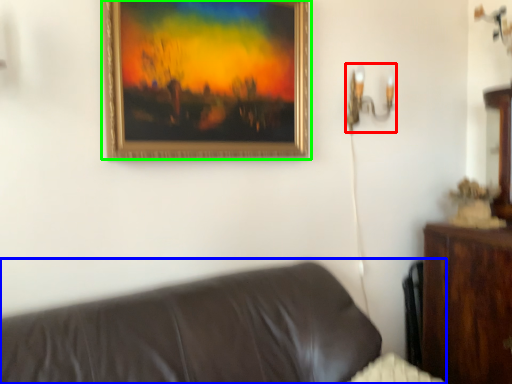
Question: Which object is the farthest from table lamp (highlighted by a red box)? Choose among these: studio couch (highlighted by a blue box) or picture frame (highlighted by a green box).

Choices:
 (A) studio couch
 (B) picture frame

Answer: (A)